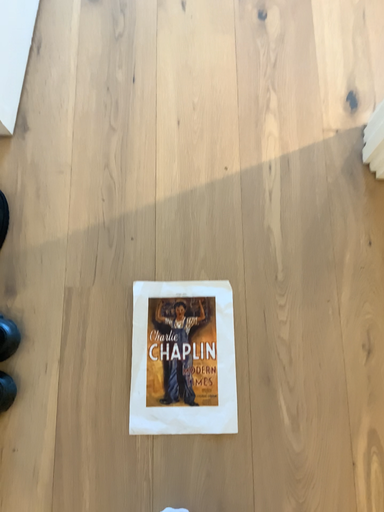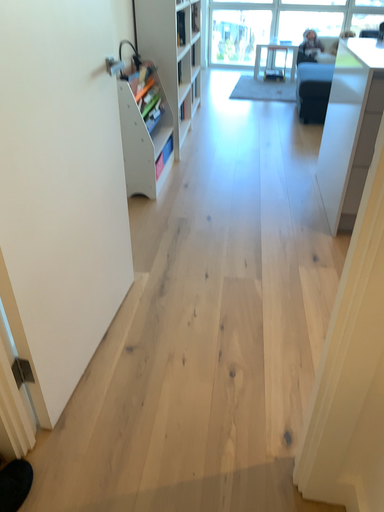
Question: Which way did the camera rotate in the video?

Choices:
 (A) rotated upward
 (B) rotated downward

Answer: (A)